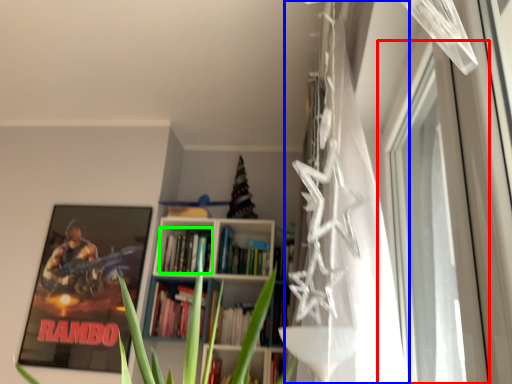
Question: Estimate the real-world distances between objects in this image. Which object is closer to window (highlighted by a red box), curtain (highlighted by a blue box) or book (highlighted by a green box)?

Choices:
 (A) curtain
 (B) book

Answer: (A)